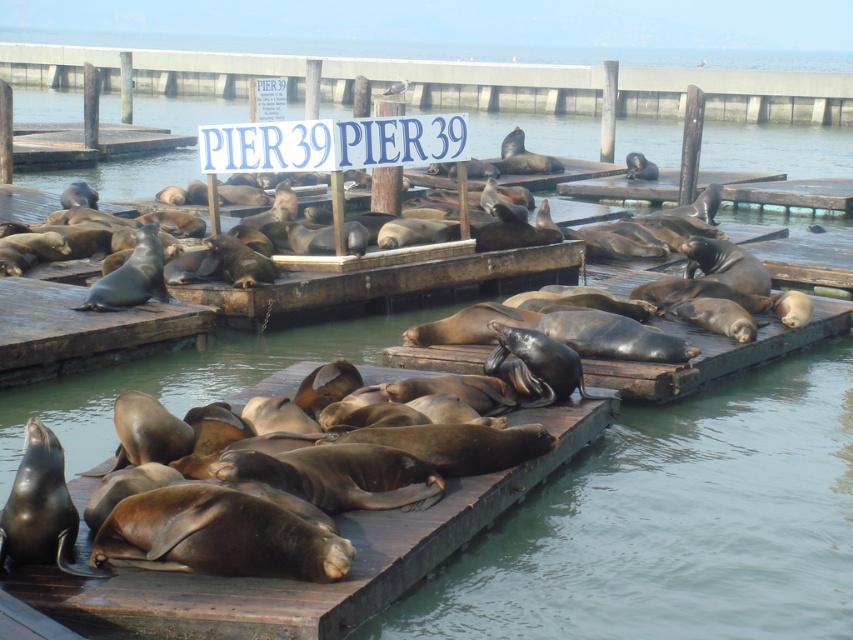
Question: Is brown wooden dock at center to the right of blue plastic sign at upper center from the viewer's perspective?

Choices:
 (A) yes
 (B) no

Answer: (A)

Question: Which point is closer to the camera?

Choices:
 (A) (428, 72)
 (B) (49, 576)

Answer: (B)

Question: Among these objects, which one is nearest to the camera?

Choices:
 (A) blue plastic sign at upper center
 (B) brown matte dock at lower left

Answer: (B)

Question: Can you confirm if brown matte dock at lower left is positioned above brown wooden dock at center?

Choices:
 (A) no
 (B) yes

Answer: (A)

Question: Estimate the real-world distances between objects in this image. Which object is closer to the brown wooden dock at center?

Choices:
 (A) blue plastic sign at upper center
 (B) brown matte dock at lower left

Answer: (A)

Question: Can you confirm if brown wooden dock at center is positioned below blue plastic sign at upper center?

Choices:
 (A) yes
 (B) no

Answer: (B)